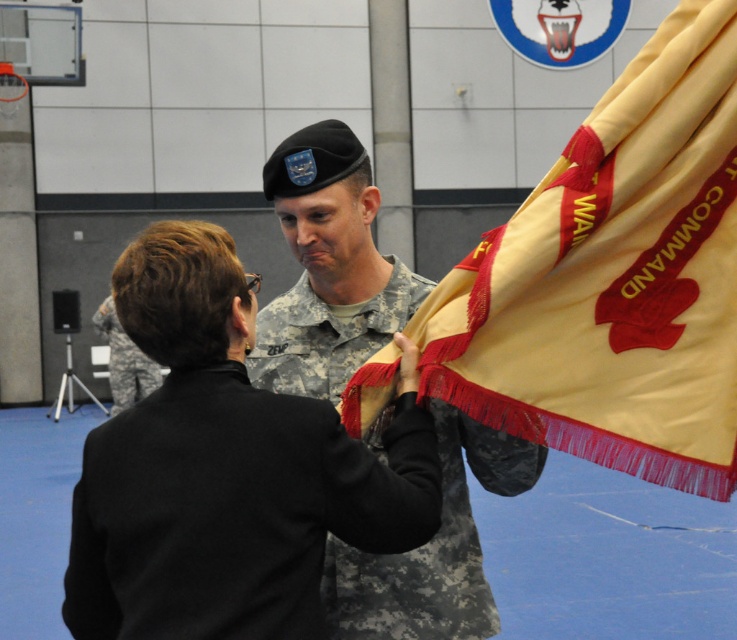
You are attending a military ceremony and notice the yellow satin flag at right and the camouflage fabric uniform at left. Which object is positioned closer to you?

The yellow satin flag at right is closer to the viewer than the camouflage fabric uniform at left.